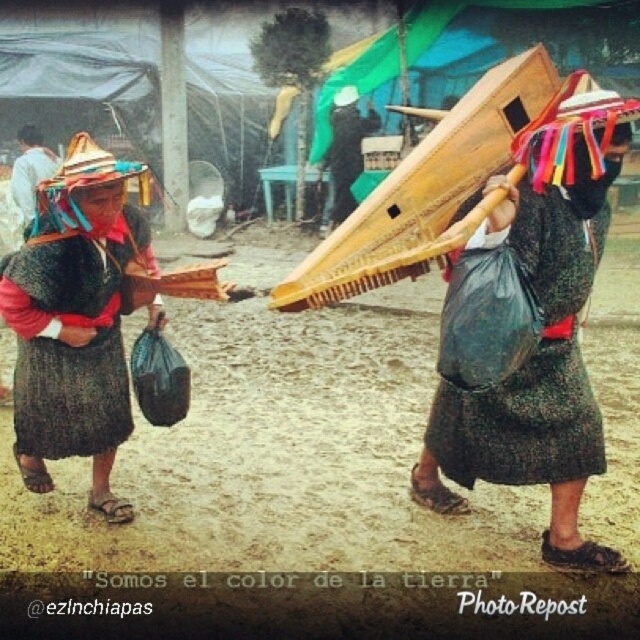
You are standing in front of the two women in traditional attire. You want to take a photo that includes both of them. Which point, point (528,196) or point (60,454), is closer to the camera and should be framed first to ensure both are in focus?

Point (528,196) is closer to the camera than point (60,454), so framing the photo to include this point first will help ensure both are in focus.

You are a photographer standing in the background of this scene, wanting to capture both the matte black shawl at left and the black textured dress at center in a single frame. Given that your camera has a maximum focus range of 1.5 meters, will you be able to include both subjects clearly in your photo?

The matte black shawl at left and the black textured dress at center are 1.49 meters apart from each other. Since the distance between them is within the camera

You are a photographer trying to capture the two women in the foreground. You want to ensure that both the matte black shawl at left and the dark gray woven skirt at left are fully visible in your shot. Based on their positions, which item might require you to adjust your camera angle to include its full width?

The matte black shawl at left might require adjusting the camera angle because it is wider than the dark gray woven skirt at left, so to fully capture it, you might need to widen your shot or move closer.